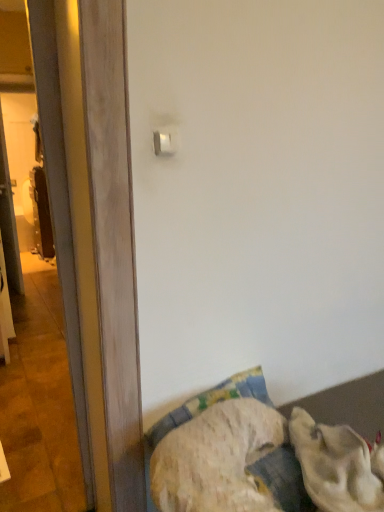
Question: Is transparent glass screen door at left further to camera compared to fluffy fabric bed at lower right?

Choices:
 (A) no
 (B) yes

Answer: (B)

Question: From a real-world perspective, is transparent glass screen door at left positioned under fluffy fabric bed at lower right based on gravity?

Choices:
 (A) yes
 (B) no

Answer: (B)

Question: Can you confirm if transparent glass screen door at left is wider than fluffy fabric bed at lower right?

Choices:
 (A) no
 (B) yes

Answer: (A)

Question: Is transparent glass screen door at left positioned beyond the bounds of fluffy fabric bed at lower right?

Choices:
 (A) yes
 (B) no

Answer: (A)

Question: Is transparent glass screen door at left not close to fluffy fabric bed at lower right?

Choices:
 (A) yes
 (B) no

Answer: (B)

Question: Is transparent glass screen door at left oriented towards fluffy fabric bed at lower right?

Choices:
 (A) no
 (B) yes

Answer: (A)

Question: Is white fluffy dog at lower right at the back of white plastic light switch at upper center?

Choices:
 (A) no
 (B) yes

Answer: (A)

Question: Is white plastic light switch at upper center at the left side of white fluffy dog at lower right?

Choices:
 (A) yes
 (B) no

Answer: (A)

Question: From the image's perspective, is white plastic light switch at upper center on top of white fluffy dog at lower right?

Choices:
 (A) no
 (B) yes

Answer: (B)

Question: Are white plastic light switch at upper center and white fluffy dog at lower right located far from each other?

Choices:
 (A) no
 (B) yes

Answer: (A)

Question: Considering the relative sizes of white plastic light switch at upper center and white fluffy dog at lower right in the image provided, is white plastic light switch at upper center bigger than white fluffy dog at lower right?

Choices:
 (A) no
 (B) yes

Answer: (A)

Question: Does white plastic light switch at upper center have a lesser height compared to white fluffy dog at lower right?

Choices:
 (A) no
 (B) yes

Answer: (B)

Question: Is transparent glass screen door at left a part of fluffy fabric bed at lower right?

Choices:
 (A) yes
 (B) no

Answer: (B)